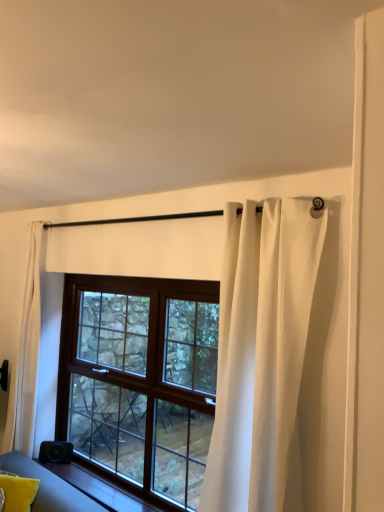
Measure the distance between point (21,497) and camera.

The distance of point (21,497) from camera is 2.62 meters.

Where is `white sheer curtain at left, the second curtain viewed from the right`? The height and width of the screenshot is (512, 384). white sheer curtain at left, the second curtain viewed from the right is located at coordinates (28, 350).

What is the approximate width of brown wooden window at center?

15.45 centimeters.

What do you see at coordinates (140, 380) in the screenshot?
I see `brown wooden window at center` at bounding box center [140, 380].

What are the coordinates of `yellow fabric pillow at lower left` in the screenshot? It's located at (18, 492).

Considering the relative positions of white sheer curtain at left, the second curtain viewed from the right, and yellow fabric pillow at lower left in the image provided, is white sheer curtain at left, the second curtain viewed from the right, to the left of yellow fabric pillow at lower left from the viewer's perspective?

Yes.

Who is taller, white sheer curtain at left, the second curtain viewed from the right, or yellow fabric pillow at lower left?

white sheer curtain at left, the second curtain viewed from the right, is taller.

From the image's perspective, does white sheer curtain at left, the second curtain viewed from the right, appear lower than yellow fabric pillow at lower left?

Incorrect, from the image's perspective, white sheer curtain at left, the second curtain viewed from the right, is higher than yellow fabric pillow at lower left.

Does white sheer curtain at left, which is the 1th curtain from back to front, have a larger size compared to yellow fabric pillow at lower left?

Indeed, white sheer curtain at left, which is the 1th curtain from back to front, has a larger size compared to yellow fabric pillow at lower left.

Considering the relative positions of smooth wood window sill at lower left and yellow fabric pillow at lower left in the image provided, is smooth wood window sill at lower left to the right of yellow fabric pillow at lower left from the viewer's perspective?

Correct, you'll find smooth wood window sill at lower left to the right of yellow fabric pillow at lower left.

Does smooth wood window sill at lower left have a lesser height compared to yellow fabric pillow at lower left?

Yes.

Is smooth wood window sill at lower left in front of or behind yellow fabric pillow at lower left in the image?

smooth wood window sill at lower left is in front of yellow fabric pillow at lower left.

Considering the relative sizes of white sheer curtain at left, positioned as the 2th curtain in front-to-back order, and brown wooden window at center in the image provided, is white sheer curtain at left, positioned as the 2th curtain in front-to-back order, wider than brown wooden window at center?

Indeed, white sheer curtain at left, positioned as the 2th curtain in front-to-back order, has a greater width compared to brown wooden window at center.

Measure the distance from white sheer curtain at left, which is the 1th curtain from back to front, to brown wooden window at center.

white sheer curtain at left, which is the 1th curtain from back to front, is 28.82 inches away from brown wooden window at center.

In the image, there is a white sheer curtain at left, which is the 1th curtain from back to front. What are the coordinates of `window below it (from a real-world perspective)` in the screenshot? It's located at (140, 380).

Is white sheer curtain at left, placed as the 1th curtain when sorted from left to right, facing towards brown wooden window at center?

No, white sheer curtain at left, placed as the 1th curtain when sorted from left to right, is not aimed at brown wooden window at center.

Can you confirm if yellow fabric pillow at lower left is shorter than smooth wood window sill at lower left?

No.

Looking at this image, which of these two, yellow fabric pillow at lower left or smooth wood window sill at lower left, is wider?

smooth wood window sill at lower left.

Which is more to the left, yellow fabric pillow at lower left or smooth wood window sill at lower left?

From the viewer's perspective, yellow fabric pillow at lower left appears more on the left side.

Is yellow fabric pillow at lower left inside the boundaries of smooth wood window sill at lower left, or outside?

yellow fabric pillow at lower left is outside smooth wood window sill at lower left.

The width and height of the screenshot is (384, 512). I want to click on window sill directly beneath the white sheer curtain at left, placed as the 1th curtain when sorted from left to right (from a real-world perspective), so pos(100,489).

How many degrees apart are the facing directions of white sheer curtain at left, positioned as the 2th curtain in front-to-back order, and smooth wood window sill at lower left?

The facing directions of white sheer curtain at left, positioned as the 2th curtain in front-to-back order, and smooth wood window sill at lower left are 0.0738 degrees apart.

Does white sheer curtain at left, placed as the 1th curtain when sorted from left to right, turn towards smooth wood window sill at lower left?

No, white sheer curtain at left, placed as the 1th curtain when sorted from left to right, is not turned towards smooth wood window sill at lower left.

Which is in front, point (40, 244) or point (109, 499)?

Positioned in front is point (109, 499).

Between smooth wood window sill at lower left and white sheer curtain at left, positioned as the 2th curtain in front-to-back order, which one has larger width?

Wider between the two is white sheer curtain at left, positioned as the 2th curtain in front-to-back order.

Can you confirm if smooth wood window sill at lower left is positioned to the right of white sheer curtain at left, positioned as the 2th curtain in front-to-back order?

Indeed, smooth wood window sill at lower left is positioned on the right side of white sheer curtain at left, positioned as the 2th curtain in front-to-back order.

From the picture: Could you measure the distance between smooth wood window sill at lower left and white sheer curtain at left, the second curtain viewed from the right?

They are 32.30 inches apart.

Is the surface of smooth wood window sill at lower left in direct contact with white sheer curtain at left, placed as the 1th curtain when sorted from left to right?

No, smooth wood window sill at lower left is not making contact with white sheer curtain at left, placed as the 1th curtain when sorted from left to right.

Is white sheer curtain at upper center, which is counted as the 2th curtain, starting from the back, positioned with its back to smooth wood window sill at lower left?

white sheer curtain at upper center, which is counted as the 2th curtain, starting from the back, is not turned away from smooth wood window sill at lower left.

Is white sheer curtain at upper center, placed as the 1th curtain when sorted from right to left, bigger than smooth wood window sill at lower left?

Yes.

Who is taller, white sheer curtain at upper center, the 1th curtain positioned from the front, or smooth wood window sill at lower left?

white sheer curtain at upper center, the 1th curtain positioned from the front, is taller.

I want to click on curtain on the left of yellow fabric pillow at lower left, so click(x=28, y=350).

At what (x,y) coordinates should I click in order to perform the action: click on window sill in front of the yellow fabric pillow at lower left. Please return your answer as a coordinate pair (x, y). The width and height of the screenshot is (384, 512). Looking at the image, I should click on (100, 489).

Which object lies nearer to the anchor point white sheer curtain at upper center, which is counted as the 2th curtain, starting from the back, white sheer curtain at left, placed as the 1th curtain when sorted from left to right, or smooth wood window sill at lower left?

The object closer to white sheer curtain at upper center, which is counted as the 2th curtain, starting from the back, is smooth wood window sill at lower left.

When comparing their distances from yellow fabric pillow at lower left, does brown wooden window at center or white sheer curtain at upper center, which is counted as the 2th curtain, starting from the back, seem closer?

Among the two, brown wooden window at center is located nearer to yellow fabric pillow at lower left.

From the image, which object appears to be nearer to white sheer curtain at left, positioned as the 2th curtain in front-to-back order, smooth wood window sill at lower left or yellow fabric pillow at lower left?

Based on the image, smooth wood window sill at lower left appears to be nearer to white sheer curtain at left, positioned as the 2th curtain in front-to-back order.

From the image, which object appears to be farther from brown wooden window at center, smooth wood window sill at lower left or white sheer curtain at upper center, the 1th curtain positioned from the front?

white sheer curtain at upper center, the 1th curtain positioned from the front, lies further to brown wooden window at center than the other object.

From the image, which object appears to be nearer to brown wooden window at center, white sheer curtain at left, placed as the 1th curtain when sorted from left to right, or smooth wood window sill at lower left?

smooth wood window sill at lower left.

Consider the image. When comparing their distances from white sheer curtain at upper center, the 1th curtain positioned from the front, does smooth wood window sill at lower left or white sheer curtain at left, positioned as the 2th curtain in front-to-back order, seem closer?

smooth wood window sill at lower left is positioned closer to the anchor white sheer curtain at upper center, the 1th curtain positioned from the front.

Estimate the real-world distances between objects in this image. Which object is closer to brown wooden window at center, yellow fabric pillow at lower left or smooth wood window sill at lower left?

smooth wood window sill at lower left is closer to brown wooden window at center.

From the image, which object appears to be farther from white sheer curtain at left, which is the 1th curtain from back to front, white sheer curtain at upper center, placed as the 1th curtain when sorted from right to left, or brown wooden window at center?

The object further to white sheer curtain at left, which is the 1th curtain from back to front, is white sheer curtain at upper center, placed as the 1th curtain when sorted from right to left.

This screenshot has height=512, width=384. I want to click on window sill between yellow fabric pillow at lower left and white sheer curtain at upper center, the 1th curtain positioned from the front, so click(100, 489).

Locate an element on the screen. Image resolution: width=384 pixels, height=512 pixels. window between white sheer curtain at left, placed as the 1th curtain when sorted from left to right, and white sheer curtain at upper center, the 1th curtain positioned from the front is located at coordinates (140, 380).

Identify the location of window sill located between yellow fabric pillow at lower left and brown wooden window at center in the left-right direction. (100, 489).

What are the coordinates of `pillow between white sheer curtain at left, positioned as the 2th curtain in front-to-back order, and smooth wood window sill at lower left vertically` in the screenshot? It's located at (18, 492).